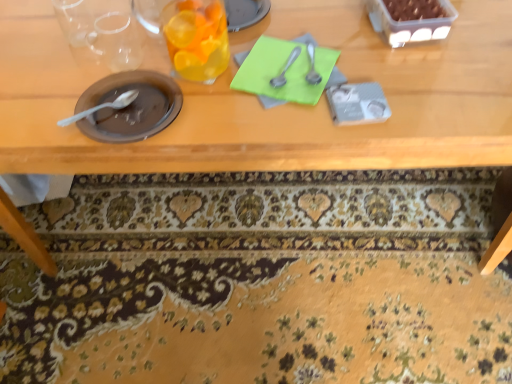
Locate an element on the screen. The height and width of the screenshot is (384, 512). free space to the left of satin silver spoon at upper center, the first tableware in the right-to-left sequence is located at coordinates (229, 81).